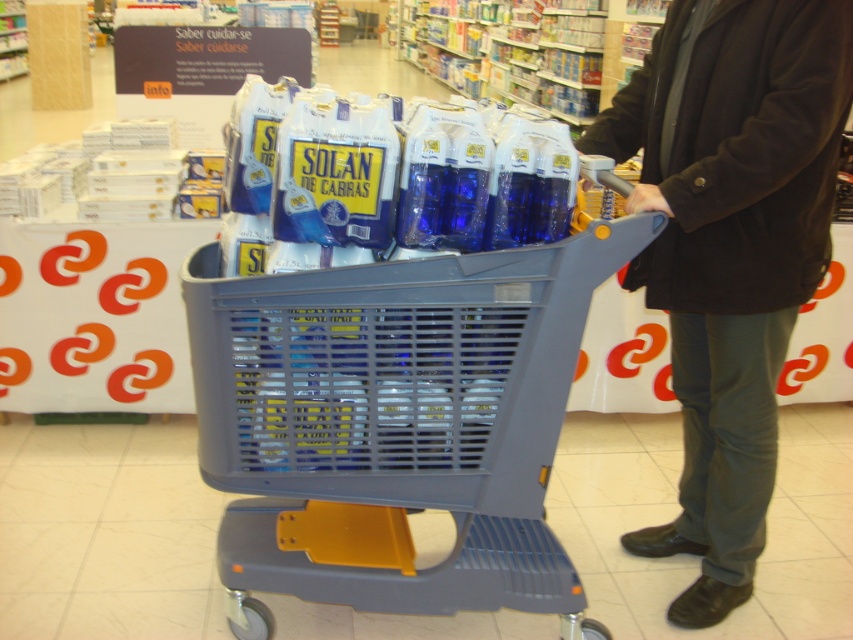
Between gray plastic trolley at center and dark brown wool coat at center, which one has more height?

With more height is dark brown wool coat at center.

Does gray plastic trolley at center have a lesser height compared to dark brown wool coat at center?

Indeed, gray plastic trolley at center has a lesser height compared to dark brown wool coat at center.

You are a GUI agent. You are given a task and a screenshot of the screen. Output one action in this format:
    pyautogui.click(x=<x>, y=<y>)
    Task: Click on the gray plastic trolley at center
    This screenshot has height=640, width=853.
    Given the screenshot: What is the action you would take?
    pyautogui.click(x=393, y=424)

This screenshot has height=640, width=853. I want to click on gray plastic trolley at center, so click(393, 424).